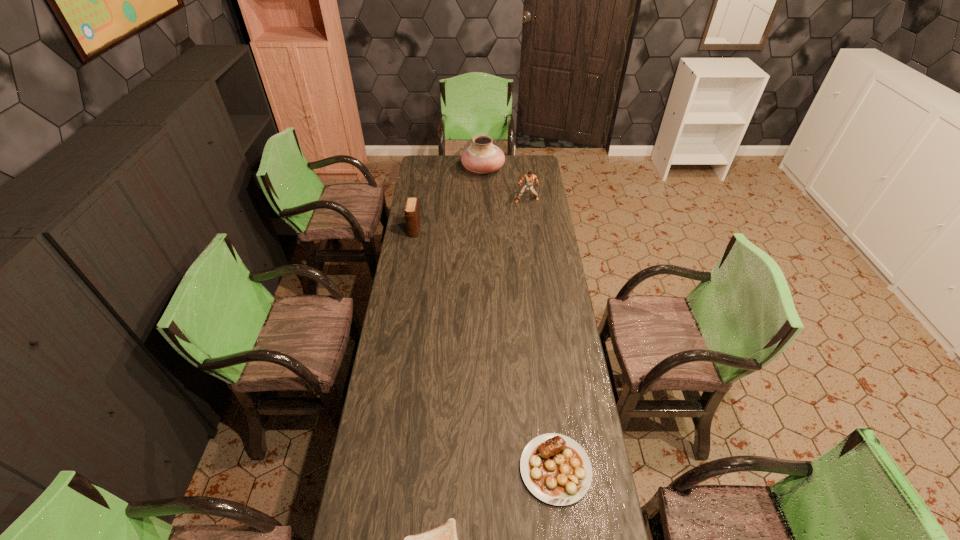
Where is `empty location between the pottery and the fourth farthest object`? Image resolution: width=960 pixels, height=540 pixels. empty location between the pottery and the fourth farthest object is located at coordinates (519, 319).

In order to click on unoccupied position between the second farthest object and the pottery in this screenshot , I will do (x=505, y=185).

This screenshot has width=960, height=540. In order to click on free spot between the leftmost object and the second shortest object in this screenshot , I will do `click(485, 349)`.

What are the coordinates of `free spot between the pottery and the third farthest object` in the screenshot? It's located at (448, 200).

In order to click on blank region between the puncher and the farthest object in this screenshot , I will do `click(505, 185)`.

Find the location of a particular element. the second closest object to the second nearest object is located at coordinates (412, 213).

Image resolution: width=960 pixels, height=540 pixels. Find the location of `the closest object to the toast`. the closest object to the toast is located at coordinates (556, 469).